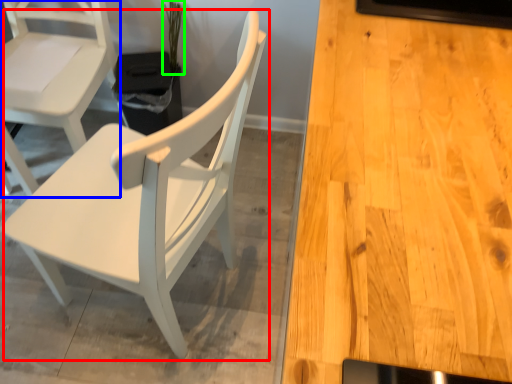
Question: Based on their relative distances, which object is nearer to chair (highlighted by a red box)? Choose from chair (highlighted by a blue box) and plant (highlighted by a green box).

Choices:
 (A) chair
 (B) plant

Answer: (A)